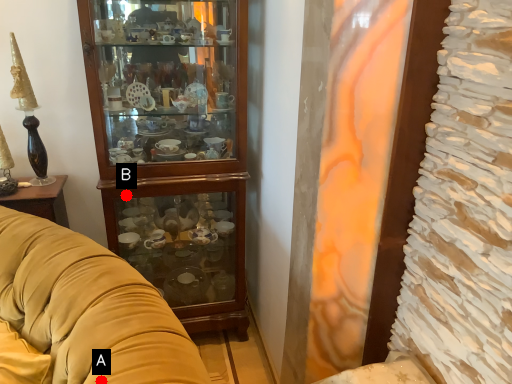
Question: Two points are circled on the image, labeled by A and B beside each circle. Which of the following is the closest to the observer?

Choices:
 (A) A is closer
 (B) B is closer

Answer: (A)